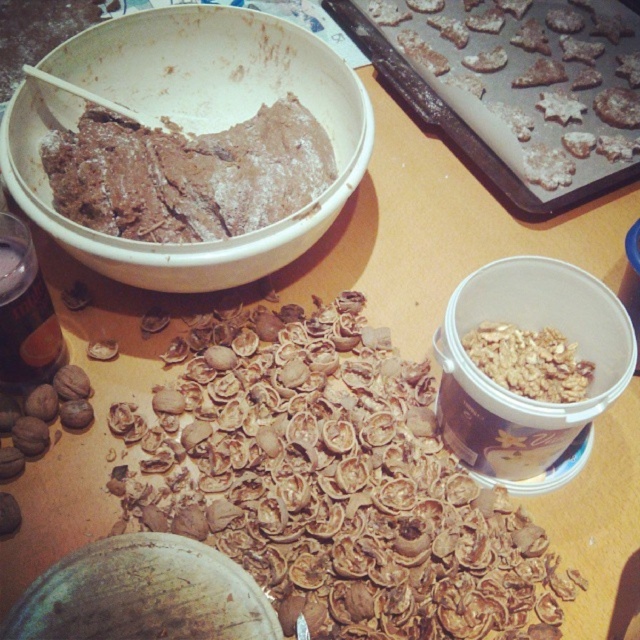
Question: Which object is closer to the camera taking this photo?

Choices:
 (A) sugared cookie dough at upper right
 (B) brown textured walnut shells at center
 (C) brown matte bowl at upper left
 (D) chocolate dough at center

Answer: (B)

Question: Among these objects, which one is nearest to the camera?

Choices:
 (A) sugared cookie dough at upper right
 (B) brown textured walnut shells at center
 (C) brown matte bowl at upper left
 (D) chocolate dough at center

Answer: (B)

Question: Is brown textured walnut shells at center below chocolate dough at center?

Choices:
 (A) no
 (B) yes

Answer: (B)

Question: Is brown textured walnut shells at center in front of brown matte bowl at upper left?

Choices:
 (A) yes
 (B) no

Answer: (A)

Question: Can you confirm if brown textured walnut shells at center is positioned to the left of sugared cookie dough at upper right?

Choices:
 (A) yes
 (B) no

Answer: (A)

Question: Which point appears farthest from the camera in this image?

Choices:
 (A) (580, 138)
 (B) (240, 259)
 (C) (355, 625)
 (D) (204, 138)

Answer: (A)